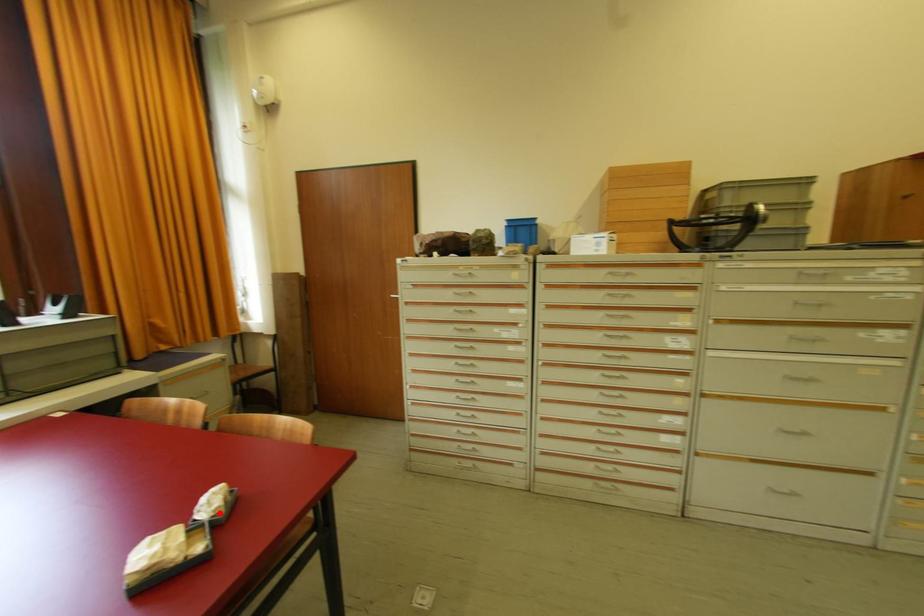
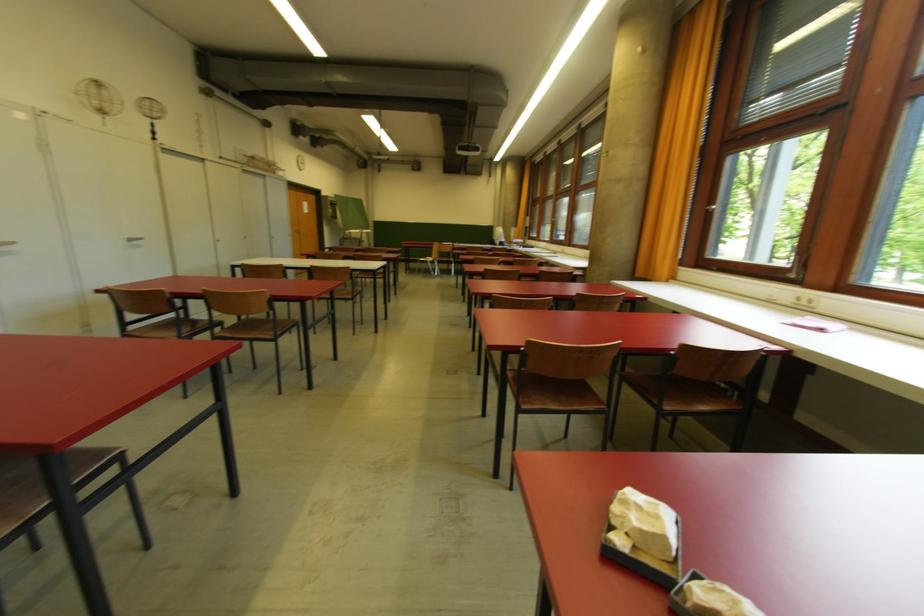
The point at the highlighted location is marked in the first image. Where is the corresponding point in the second image?

(690, 596)